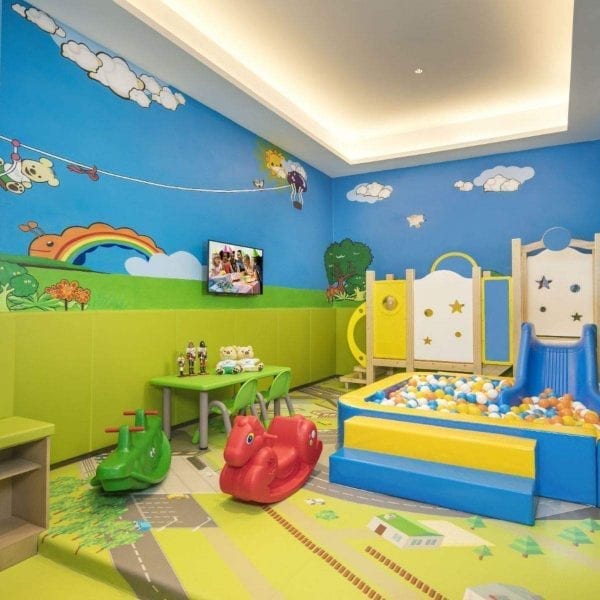
Where is `blue wall`? This screenshot has width=600, height=600. blue wall is located at coordinates (516, 224).